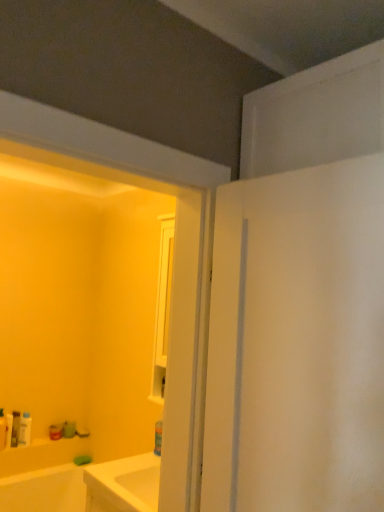
Consider the image. Measure the distance between matte green soap at lower left, the fifth toiletry viewed from the left, and camera.

2.85 meters.

How much space does matte green soap at lower left, positioned as the first toiletry in right-to-left order, occupy horizontally?

It is 3.86 inches.

Where is `matte white tube at lower left, the fourth toiletry from the right`? The image size is (384, 512). matte white tube at lower left, the fourth toiletry from the right is located at coordinates (8, 430).

Measure the distance between white plastic bottle at lower left, the fourth toiletry when ordered from left to right, and camera.

2.64 meters.

Where is `white plastic bottle at lower left, positioned as the 3th toiletry in left-to-right order`? Image resolution: width=384 pixels, height=512 pixels. white plastic bottle at lower left, positioned as the 3th toiletry in left-to-right order is located at coordinates (15, 428).

Is matte white tube at lower left, the second toiletry in the left-to-right sequence, with matte green soap at lower left, the fifth toiletry viewed from the left?

No, matte white tube at lower left, the second toiletry in the left-to-right sequence, is not in contact with matte green soap at lower left, the fifth toiletry viewed from the left.

Locate an element on the screen. toiletry that is the 2nd one below the matte white tube at lower left, the fourth toiletry from the right (from a real-world perspective) is located at coordinates (69, 429).

Is matte white tube at lower left, the second toiletry in the left-to-right sequence, not inside matte green soap at lower left, positioned as the first toiletry in right-to-left order?

matte white tube at lower left, the second toiletry in the left-to-right sequence, lies outside matte green soap at lower left, positioned as the first toiletry in right-to-left order,'s area.

Considering the sizes of objects matte white tube at lower left, the second toiletry in the left-to-right sequence, and matte green soap at lower left, positioned as the first toiletry in right-to-left order, in the image provided, who is shorter, matte white tube at lower left, the second toiletry in the left-to-right sequence, or matte green soap at lower left, positioned as the first toiletry in right-to-left order,?

With less height is matte green soap at lower left, positioned as the first toiletry in right-to-left order.

From the image's perspective, who appears lower, white plastic bottle at lower left, the 2th toiletry in the right-to-left sequence, or matte green soap at lower left, the fifth toiletry viewed from the left?

matte green soap at lower left, the fifth toiletry viewed from the left, is shown below in the image.

Is white plastic bottle at lower left, the fourth toiletry when ordered from left to right, not within matte green soap at lower left, the fifth toiletry viewed from the left?

Yes, white plastic bottle at lower left, the fourth toiletry when ordered from left to right, is located beyond the bounds of matte green soap at lower left, the fifth toiletry viewed from the left.

From a real-world perspective, is white plastic bottle at lower left, the fourth toiletry when ordered from left to right, located beneath matte green soap at lower left, positioned as the first toiletry in right-to-left order?

No.

The width and height of the screenshot is (384, 512). I want to click on the 1st toiletry directly above the matte green soap at lower left, positioned as the first toiletry in right-to-left order (from a real-world perspective), so click(15, 428).

Would you say matte green soap at lower left, positioned as the first toiletry in right-to-left order, is to the left or to the right of white plastic bottle at lower left, positioned as the 3th toiletry in left-to-right order, in the picture?

Based on their positions, matte green soap at lower left, positioned as the first toiletry in right-to-left order, is located to the right of white plastic bottle at lower left, positioned as the 3th toiletry in left-to-right order.

Is matte green soap at lower left, the fifth toiletry viewed from the left, next to white plastic bottle at lower left, positioned as the 3th toiletry in left-to-right order?

No, matte green soap at lower left, the fifth toiletry viewed from the left, is not next to white plastic bottle at lower left, positioned as the 3th toiletry in left-to-right order.

Does matte green soap at lower left, the fifth toiletry viewed from the left, have a smaller size compared to white plastic bottle at lower left, positioned as the 3th toiletry in left-to-right order?

Incorrect, matte green soap at lower left, the fifth toiletry viewed from the left, is not smaller in size than white plastic bottle at lower left, positioned as the 3th toiletry in left-to-right order.

Can you confirm if matte white tube at lower left, the fourth toiletry from the right, is positioned to the left of matte white bottle at lower left, the first toiletry positioned from the left?

In fact, matte white tube at lower left, the fourth toiletry from the right, is to the right of matte white bottle at lower left, the first toiletry positioned from the left.

From their relative heights in the image, would you say matte white tube at lower left, the fourth toiletry from the right, is taller or shorter than matte white bottle at lower left, the first toiletry positioned from the left?

Clearly, matte white tube at lower left, the fourth toiletry from the right, is shorter compared to matte white bottle at lower left, the first toiletry positioned from the left.

Are matte white tube at lower left, the second toiletry in the left-to-right sequence, and matte white bottle at lower left, the first toiletry positioned from the left, beside each other?

Yes, matte white tube at lower left, the second toiletry in the left-to-right sequence, is touching matte white bottle at lower left, the first toiletry positioned from the left.

Can you confirm if matte white tube at lower left, the second toiletry in the left-to-right sequence, is wider than matte white bottle at lower left, which ranks as the 5th toiletry in right-to-left order?

Incorrect, the width of matte white tube at lower left, the second toiletry in the left-to-right sequence, does not surpass that of matte white bottle at lower left, which ranks as the 5th toiletry in right-to-left order.

Could you measure the distance between matte white bottle at lower left, which ranks as the 5th toiletry in right-to-left order, and matte green soap at lower left, the fifth toiletry viewed from the left?

16.07 inches.

Looking at this image, is the surface of matte white bottle at lower left, the first toiletry positioned from the left, in direct contact with matte green soap at lower left, positioned as the first toiletry in right-to-left order?

matte white bottle at lower left, the first toiletry positioned from the left, and matte green soap at lower left, positioned as the first toiletry in right-to-left order, are not in contact.

Which object is closer to the camera taking this photo, matte white bottle at lower left, which ranks as the 5th toiletry in right-to-left order, or matte green soap at lower left, the fifth toiletry viewed from the left?

Result: matte white bottle at lower left, which ranks as the 5th toiletry in right-to-left order, is in front.

Is point (6, 440) closer to viewer compared to point (65, 430)?

Yes.

Does matte white tube at lower left, the fourth toiletry from the right, have a lesser width compared to white plastic bottle at lower left, the fourth toiletry when ordered from left to right?

Yes.

Considering the points (8, 439) and (24, 442), which point is behind, point (8, 439) or point (24, 442)?

Point (24, 442)

I want to click on the 1st toiletry above the white plastic bottle at lower left, the 2th toiletry in the right-to-left sequence (from the image's perspective), so click(8, 430).

Is white plastic bottle at lower left, the fourth toiletry when ordered from left to right, wider or thinner than matte white bottle at lower left, the first toiletry positioned from the left?

Clearly, white plastic bottle at lower left, the fourth toiletry when ordered from left to right, has less width compared to matte white bottle at lower left, the first toiletry positioned from the left.

Considering the points (25, 442) and (3, 429), which point is behind, point (25, 442) or point (3, 429)?

The point (25, 442) is more distant.

Is white plastic bottle at lower left, the fourth toiletry when ordered from left to right, positioned far away from matte white bottle at lower left, which ranks as the 5th toiletry in right-to-left order?

No, white plastic bottle at lower left, the fourth toiletry when ordered from left to right, is in close proximity to matte white bottle at lower left, which ranks as the 5th toiletry in right-to-left order.

Considering the relative sizes of white plastic bottle at lower left, the fourth toiletry when ordered from left to right, and matte white bottle at lower left, which ranks as the 5th toiletry in right-to-left order, in the image provided, is white plastic bottle at lower left, the fourth toiletry when ordered from left to right, bigger than matte white bottle at lower left, which ranks as the 5th toiletry in right-to-left order,?

No, white plastic bottle at lower left, the fourth toiletry when ordered from left to right, is not bigger than matte white bottle at lower left, which ranks as the 5th toiletry in right-to-left order.

Identify the location of the 2nd toiletry directly beneath the matte white tube at lower left, the fourth toiletry from the right (from a real-world perspective). (69, 429).

From the image's perspective, which toiletry is the 2nd one above the matte green soap at lower left, the fifth toiletry viewed from the left? Please provide its 2D coordinates.

[(25, 430)]

When comparing their distances from matte white bottle at lower left, the first toiletry positioned from the left, does matte white tube at lower left, the fourth toiletry from the right, or white plastic bottle at lower left, the fourth toiletry when ordered from left to right, seem closer?

Based on the image, matte white tube at lower left, the fourth toiletry from the right, appears to be nearer to matte white bottle at lower left, the first toiletry positioned from the left.

Based on their spatial positions, is white plastic bottle at lower left, the 3th toiletry from the right, or matte white tube at lower left, the second toiletry in the left-to-right sequence, further from white plastic bottle at lower left, the 2th toiletry in the right-to-left sequence?

matte white tube at lower left, the second toiletry in the left-to-right sequence, is further to white plastic bottle at lower left, the 2th toiletry in the right-to-left sequence.

From the image, which object appears to be nearer to white plastic bottle at lower left, the 2th toiletry in the right-to-left sequence, matte white bottle at lower left, which ranks as the 5th toiletry in right-to-left order, or matte white tube at lower left, the second toiletry in the left-to-right sequence?

matte white tube at lower left, the second toiletry in the left-to-right sequence, is positioned closer to the anchor white plastic bottle at lower left, the 2th toiletry in the right-to-left sequence.

Which object lies further to the anchor point white plastic bottle at lower left, the fourth toiletry when ordered from left to right, matte white tube at lower left, the second toiletry in the left-to-right sequence, or white plastic bottle at lower left, the 3th toiletry from the right?

The object further to white plastic bottle at lower left, the fourth toiletry when ordered from left to right, is matte white tube at lower left, the second toiletry in the left-to-right sequence.

Looking at the image, which one is located closer to matte white tube at lower left, the second toiletry in the left-to-right sequence, white plastic bottle at lower left, the 3th toiletry from the right, or white plastic bottle at lower left, the fourth toiletry when ordered from left to right?

white plastic bottle at lower left, the 3th toiletry from the right, is positioned closer to the anchor matte white tube at lower left, the second toiletry in the left-to-right sequence.

Looking at the image, which one is located closer to matte white bottle at lower left, which ranks as the 5th toiletry in right-to-left order, white plastic bottle at lower left, the fourth toiletry when ordered from left to right, or matte green soap at lower left, the fifth toiletry viewed from the left?

white plastic bottle at lower left, the fourth toiletry when ordered from left to right, is closer to matte white bottle at lower left, which ranks as the 5th toiletry in right-to-left order.

Based on their spatial positions, is white plastic bottle at lower left, the 2th toiletry in the right-to-left sequence, or matte green soap at lower left, positioned as the first toiletry in right-to-left order, further from matte white tube at lower left, the second toiletry in the left-to-right sequence?

matte green soap at lower left, positioned as the first toiletry in right-to-left order, is positioned further to the anchor matte white tube at lower left, the second toiletry in the left-to-right sequence.

Considering their positions, is matte white tube at lower left, the second toiletry in the left-to-right sequence, positioned further to matte white bottle at lower left, the first toiletry positioned from the left, than white plastic bottle at lower left, the 3th toiletry from the right?

Among the two, white plastic bottle at lower left, the 3th toiletry from the right, is located further to matte white bottle at lower left, the first toiletry positioned from the left.

I want to click on toiletry between white plastic bottle at lower left, the 3th toiletry from the right, and matte green soap at lower left, positioned as the first toiletry in right-to-left order, so click(25, 430).

At what (x,y) coordinates should I click in order to perform the action: click on toiletry between matte white tube at lower left, the second toiletry in the left-to-right sequence, and white plastic bottle at lower left, the 2th toiletry in the right-to-left sequence, from left to right. Please return your answer as a coordinate pair (x, y). The image size is (384, 512). Looking at the image, I should click on point(15,428).

At what (x,y) coordinates should I click in order to perform the action: click on toiletry between matte white bottle at lower left, which ranks as the 5th toiletry in right-to-left order, and white plastic bottle at lower left, the 3th toiletry from the right, from front to back. Please return your answer as a coordinate pair (x, y). The height and width of the screenshot is (512, 384). Looking at the image, I should click on (8, 430).